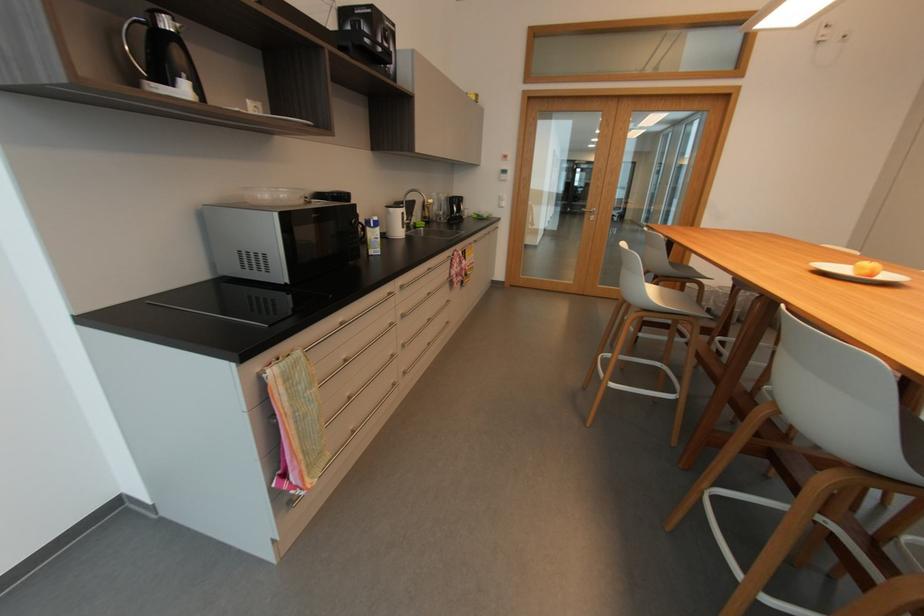
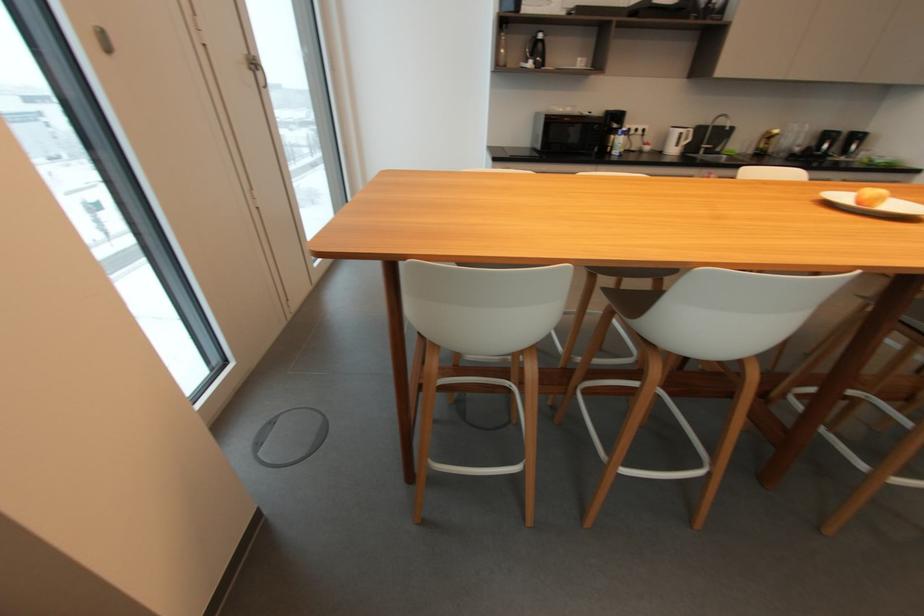
Question: I am providing you with two images of the same scene from different viewpoints. After the viewpoint changes to image2, which objects are now occluded?

Choices:
 (A) red and yellow apple
 (B) microwave door handle
 (C) white ceramic plate
 (D) none of these

Answer: (D)